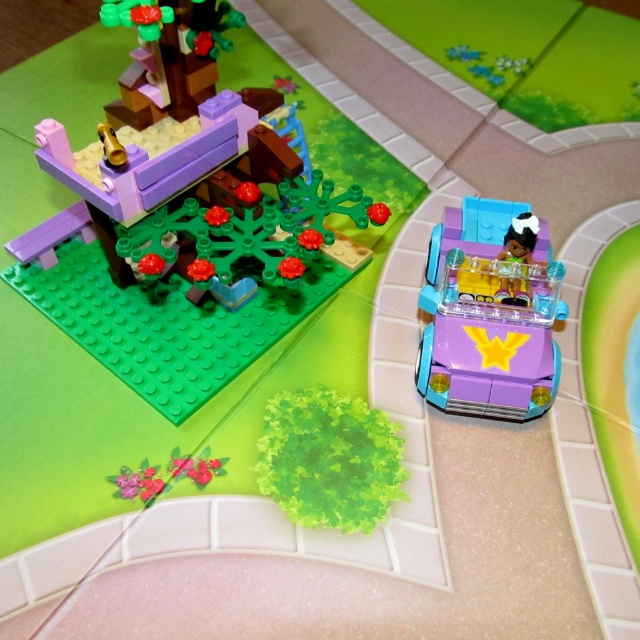
You are standing in a LEGO park scene and want to reach the purple glossy car at upper right. If your hand is 36 inches long, can you reach the car without moving your body?

The purple glossy car at upper right is 39.24 inches away from the viewer. Since your hand is only 36 inches long, you cannot reach it without moving your body.

You are examining a LEGO park scene. There are two points marked in the image. The first point is at coordinate (257, 236) and the second is at (429, 333). Based on the scene description, which point is closer to you?

Point (257, 236) is closer to the viewer than point (429, 333).

What is the significance of the point located at coordinates (188, 300) in the LEGO park scene?

The point at coordinates (188, 300) marks the location of the purple glossy car at upper right in the LEGO park scene.